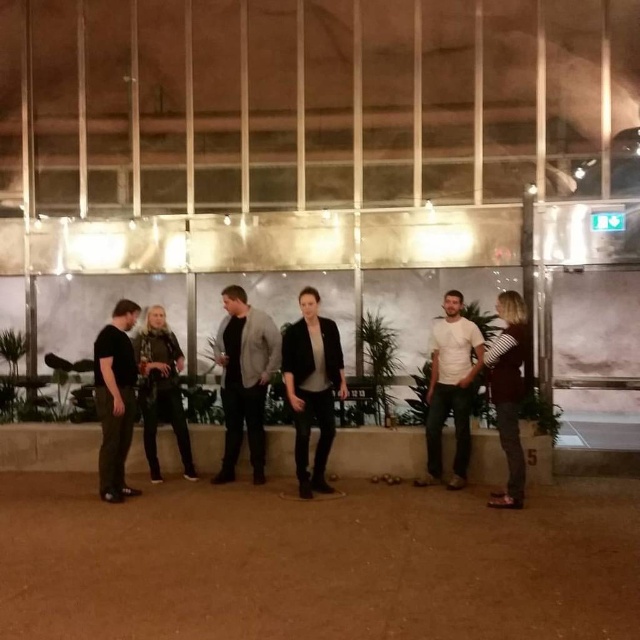
Question: Does light gray textured blazer at center appear on the left side of dark green pants at left?

Choices:
 (A) yes
 (B) no

Answer: (B)

Question: Which is nearer to the striped shirt at right?

Choices:
 (A) light gray textured blazer at center
 (B) matte black jacket at center
 (C) white matte t-shirt at center
 (D) camouflage-patterned shirt at center

Answer: (C)

Question: Can you confirm if light gray textured blazer at center is positioned above striped shirt at right?

Choices:
 (A) yes
 (B) no

Answer: (A)

Question: Among these objects, which one is nearest to the camera?

Choices:
 (A) white matte t-shirt at center
 (B) striped shirt at right

Answer: (B)

Question: Which of the following is the closest to the observer?

Choices:
 (A) light gray textured blazer at center
 (B) matte black jacket at center

Answer: (B)

Question: Can you confirm if light gray textured blazer at center is positioned above white matte t-shirt at center?

Choices:
 (A) no
 (B) yes

Answer: (B)